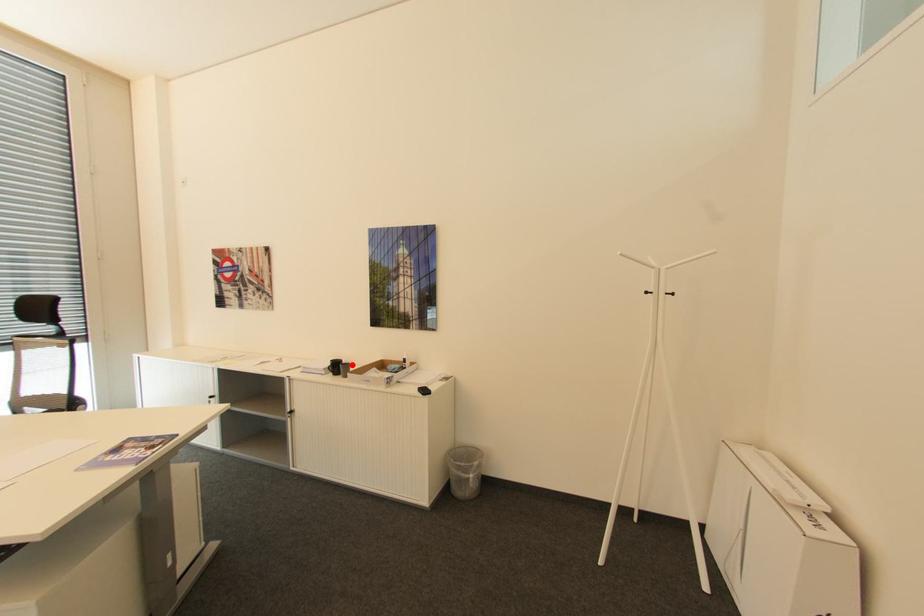
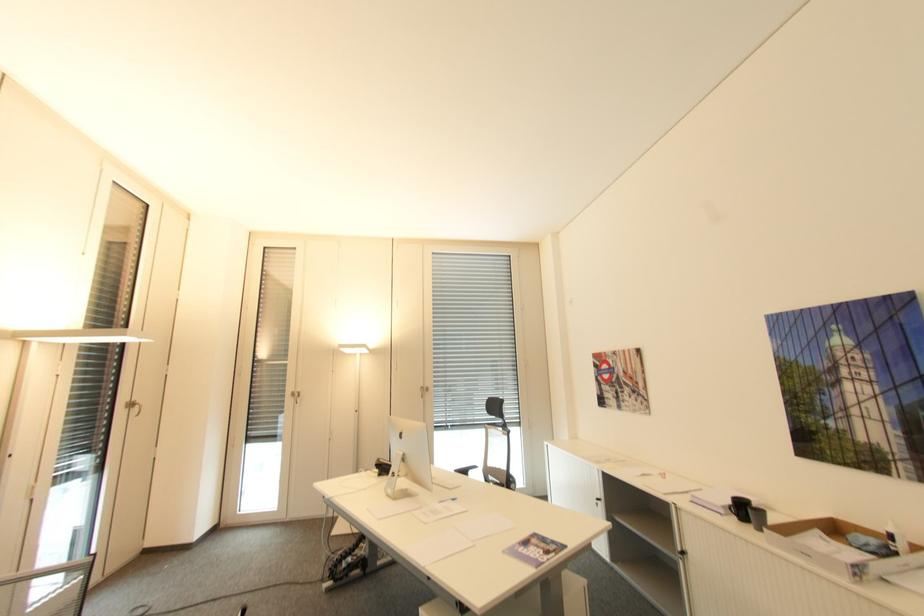
The point at the highlighted location is marked in the first image. Where is the corresponding point in the second image?

(766, 513)